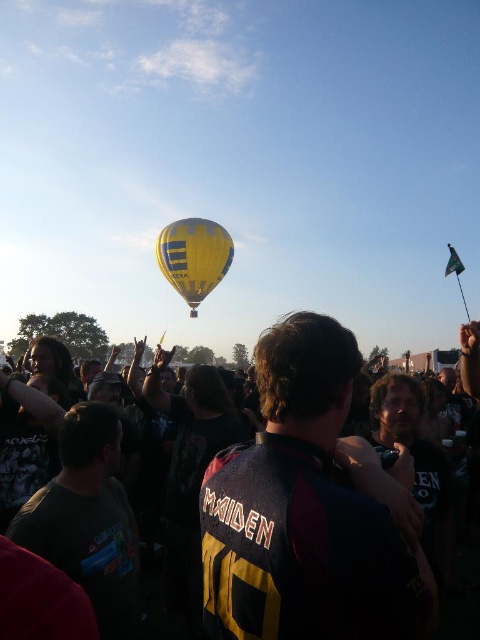
Describe the element at coordinates (300, 508) in the screenshot. I see `dark gray jersey at center` at that location.

Does dark gray jersey at center have a smaller size compared to yellow fabric balloon at center?

Incorrect, dark gray jersey at center is not smaller in size than yellow fabric balloon at center.

At what (x,y) coordinates should I click in order to perform the action: click on dark gray jersey at center. Please return your answer as a coordinate pair (x, y). The height and width of the screenshot is (640, 480). Looking at the image, I should click on (300, 508).